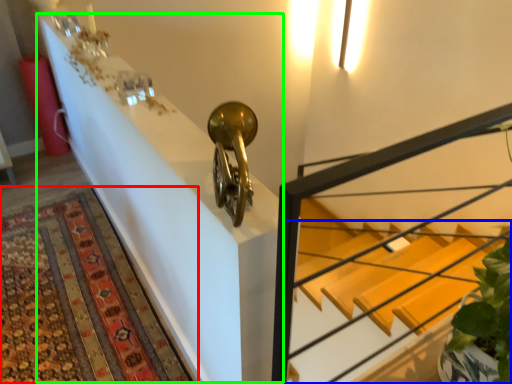
Question: Which object is positioned farthest from mat (highlighted by a red box)? Select from stairs (highlighted by a blue box) and table (highlighted by a green box).

Choices:
 (A) stairs
 (B) table

Answer: (A)